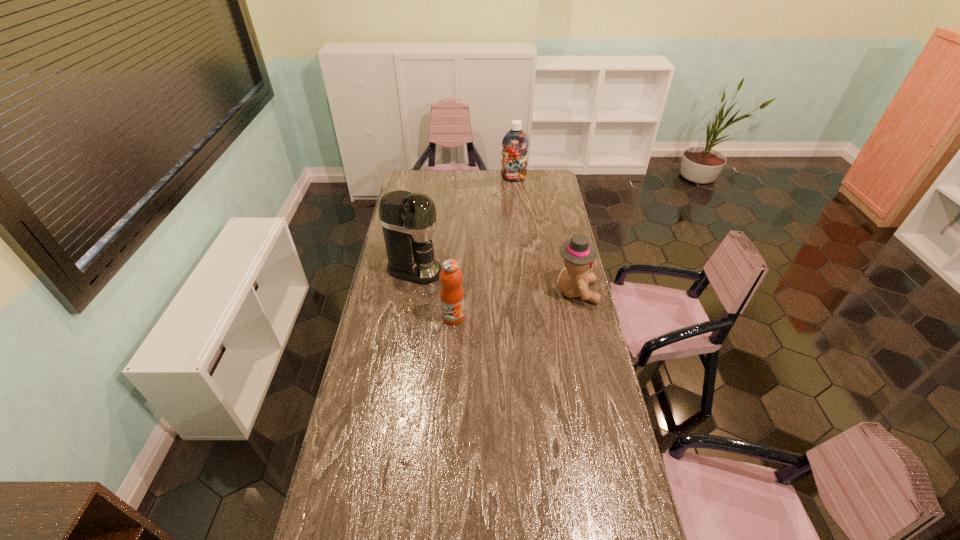
This screenshot has width=960, height=540. Find the location of `the second object from left to right`. the second object from left to right is located at coordinates (452, 295).

This screenshot has width=960, height=540. I want to click on the rightmost object, so click(x=579, y=254).

What are the coordinates of `shampoo` in the screenshot? It's located at (515, 143).

Identify the location of the third shortest object. (515, 143).

Where is `the leftmost object`? The height and width of the screenshot is (540, 960). the leftmost object is located at coordinates (408, 220).

What are the coordinates of `free space located on the front label of the second object from left to right` in the screenshot? It's located at (450, 368).

Image resolution: width=960 pixels, height=540 pixels. Identify the location of free region located on the front label of the shampoo. (509, 219).

Find the location of a particular element. free space located on the front label of the shampoo is located at coordinates (509, 214).

The image size is (960, 540). I want to click on vacant space located 0.260m on the front label of the shampoo, so click(x=510, y=207).

Identify the location of blank area located place cup under the spout of the leftmost object. (462, 281).